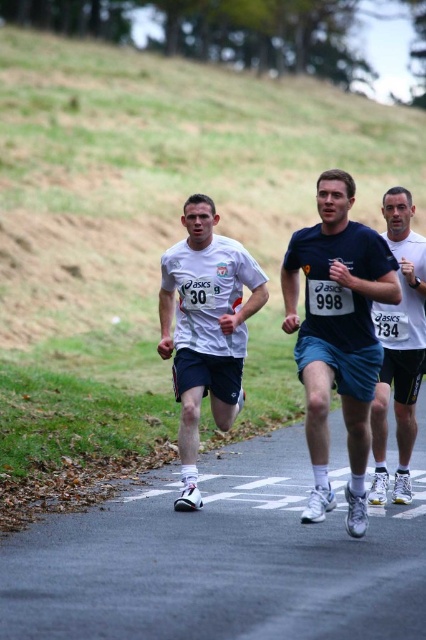
You are a photographer positioned at the starting line of the race. You want to take a photo that includes both the dark blue shorts at center and the white matte shirt at center. Which object should you focus on first to ensure both are in the frame?

You should focus on the white matte shirt at center first because the dark blue shorts at center is to the right of it, so by centering the white matte shirt, the dark blue shorts at center will naturally be included to the right side of the frame.